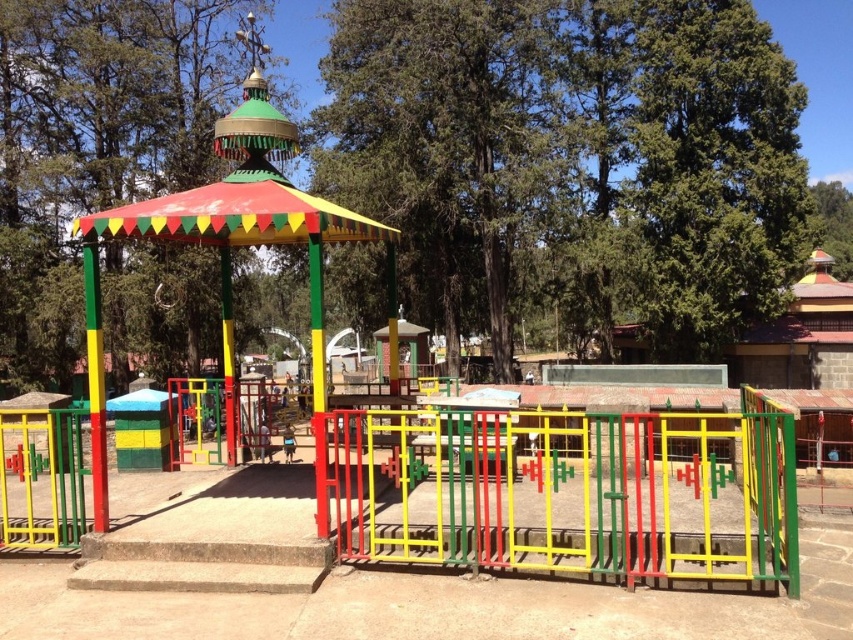
You are planning to place a new bench in the playground. The bench requires a space that is as large as the green painted wood gazebo at center. Is there enough space next to the multicolored painted gazebo at center to accommodate it?

The green painted wood gazebo at center occupies less space than the multicolored painted gazebo at center. Therefore, the space next to the multicolored painted gazebo at center is sufficient to place the bench since it requires space equal to the smaller gazebo.

You are a visitor at the playground and want to take a photo of the green painted wood gazebo at center and the multicolored painted gazebo at center. Which gazebo should you focus on if you want to capture the tallest structure in the scene?

The green painted wood gazebo at center is much taller than the multicolored painted gazebo at center, so you should focus on the green painted wood gazebo at center to capture the tallest structure in the scene.

You are standing at the entrance of the playground and see the metallic painted gate at center and the green painted wood gazebo at center. Which object is positioned to the right of the other?

The metallic painted gate at center is to the right of the green painted wood gazebo at center according to the description.